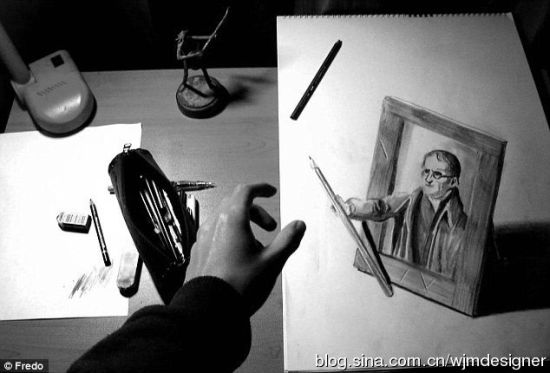
You are a GUI agent. You are given a task and a screenshot of the screen. Output one action in this format:
    pyautogui.click(x=<x>, y=<y>)
    Task: Click on the writing utensil
    The width and height of the screenshot is (550, 373).
    Given the screenshot: What is the action you would take?
    pyautogui.click(x=355, y=239), pyautogui.click(x=302, y=102), pyautogui.click(x=100, y=244), pyautogui.click(x=148, y=216), pyautogui.click(x=150, y=205), pyautogui.click(x=151, y=200), pyautogui.click(x=154, y=192), pyautogui.click(x=168, y=203), pyautogui.click(x=186, y=186)